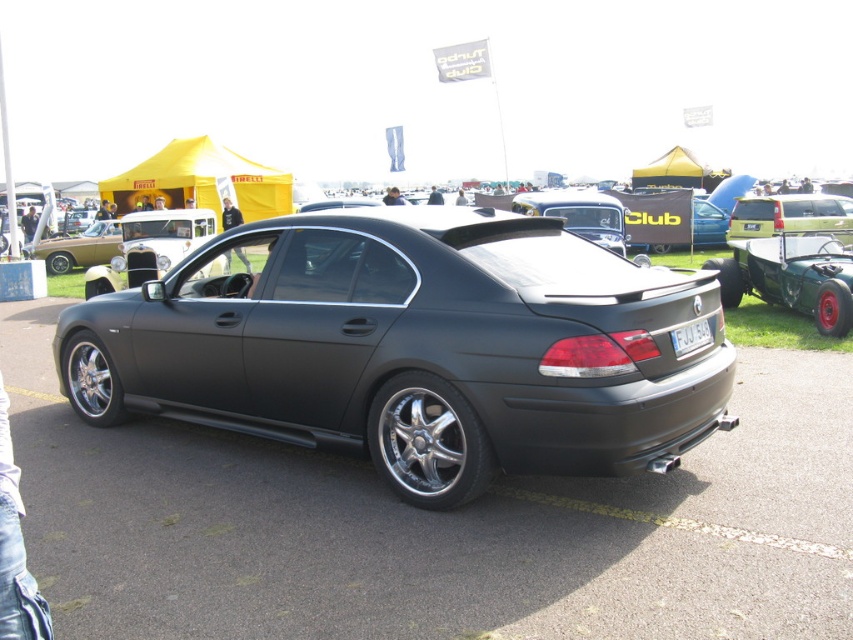
Question: Can you confirm if matte black car at left is positioned to the left of white matte license plate at rear?

Choices:
 (A) no
 (B) yes

Answer: (B)

Question: Does matte black car at center appear over matte black car at right?

Choices:
 (A) no
 (B) yes

Answer: (A)

Question: Is matte black car at right bigger than matte black car at left?

Choices:
 (A) no
 (B) yes

Answer: (A)

Question: Which object is positioned farthest from the matte black car at right?

Choices:
 (A) matte black car at left
 (B) matte black car at center
 (C) white matte license plate at rear
 (D) yellow matte license plate at center

Answer: (A)

Question: Which of the following is the closest to the observer?

Choices:
 (A) (805, 205)
 (B) (752, 221)

Answer: (A)

Question: Which point is farther from the camera taking this photo?

Choices:
 (A) (335, 444)
 (B) (102, 241)

Answer: (B)